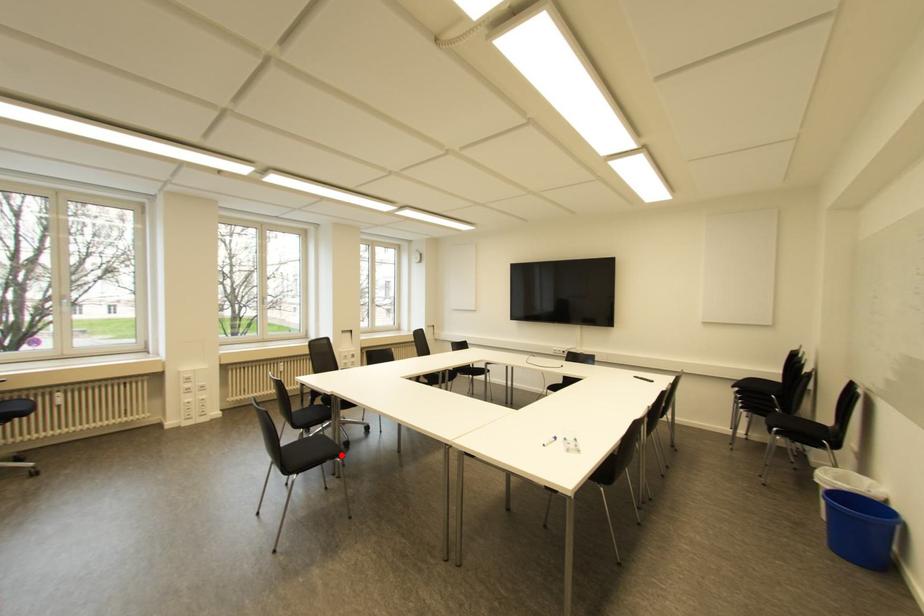
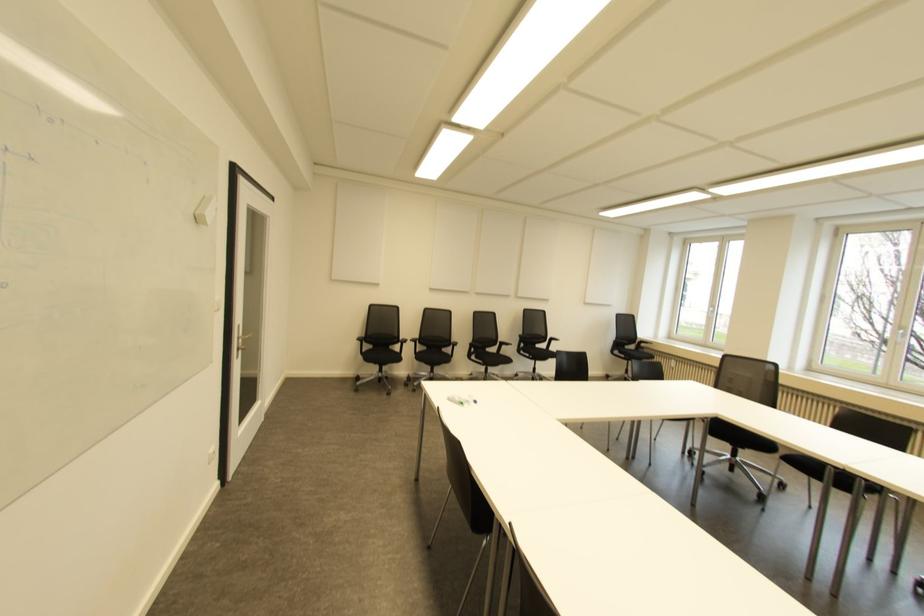
Question: I am providing you with two images of the same scene from different viewpoints. A red point is marked on the first image. Can you still see the location of the red point in image 2?

Choices:
 (A) Yes
 (B) No

Answer: (B)